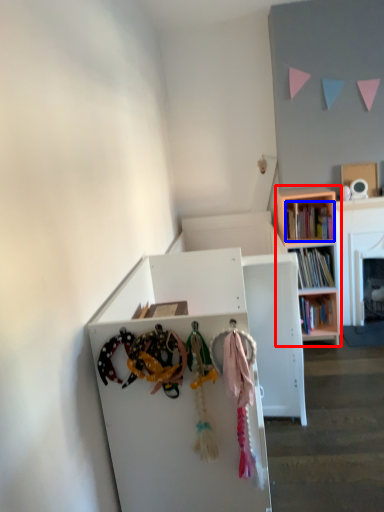
Question: Which of the following is the farthest to the observer, bookcase (highlighted by a red box) or book (highlighted by a blue box)?

Choices:
 (A) bookcase
 (B) book

Answer: (B)